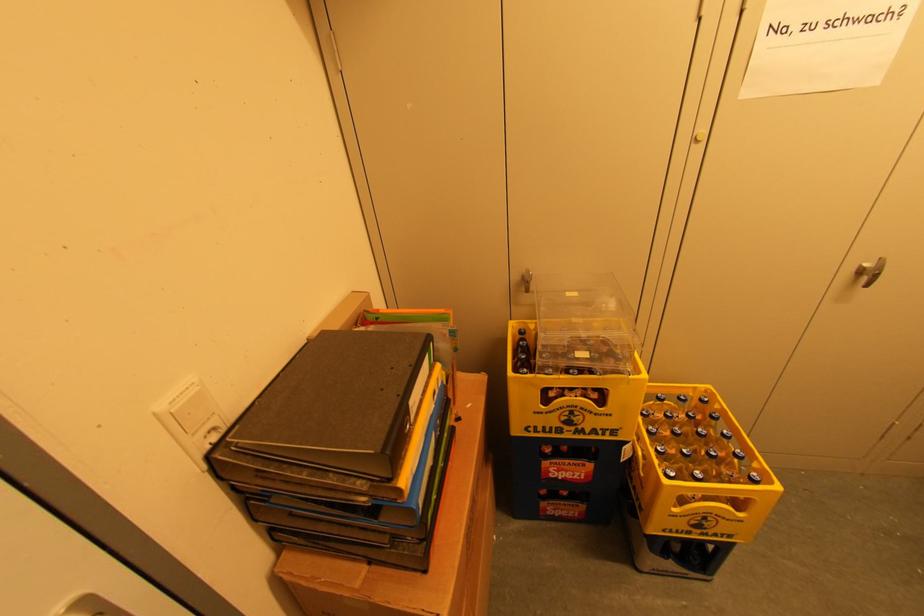
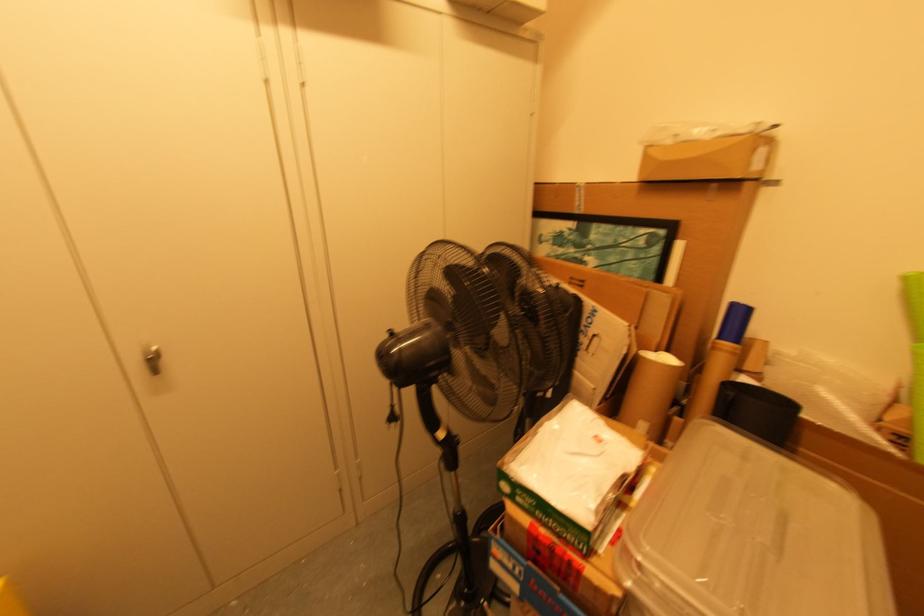
The point at (869,275) is marked in the first image. Where is the corresponding point in the second image?

(152, 361)